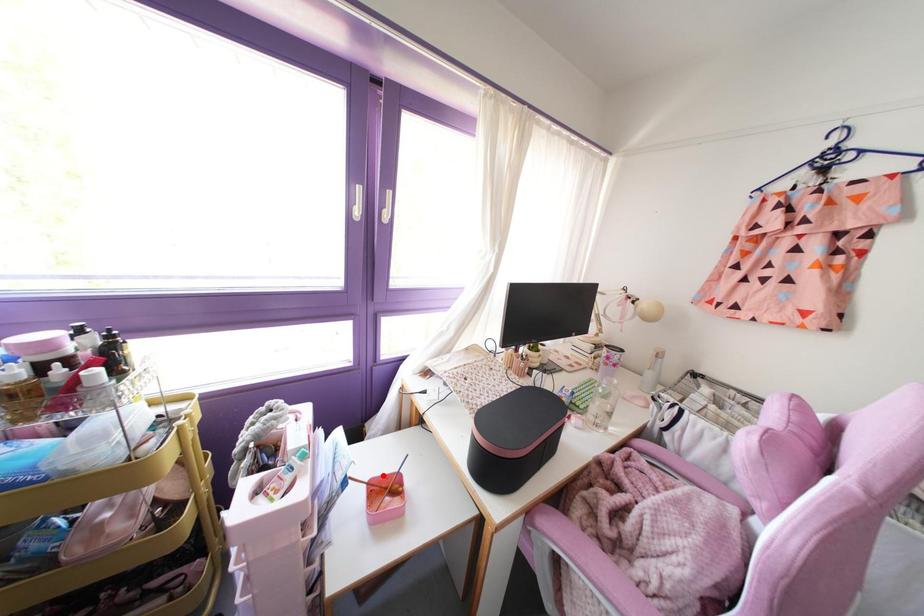
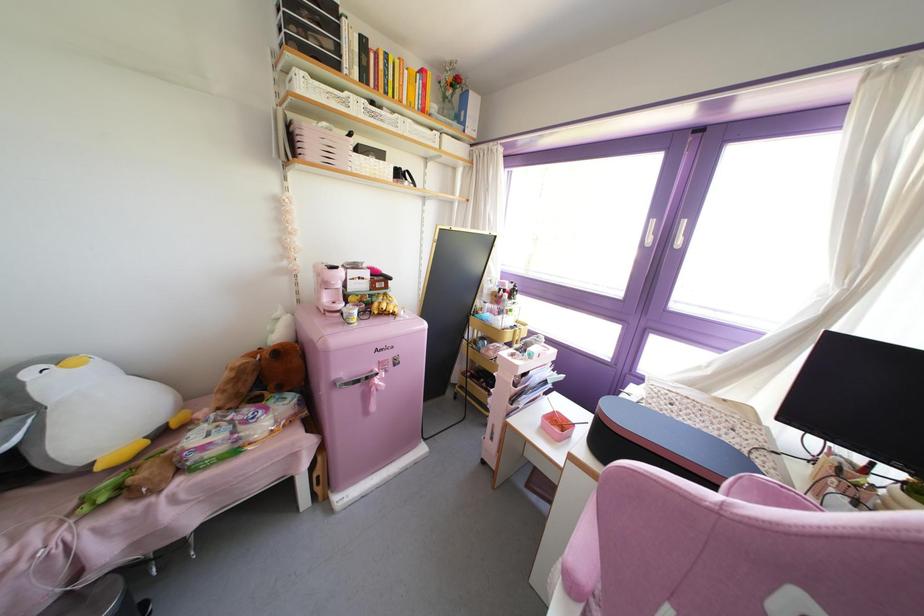
Question: I am providing you with two images of the same scene from different viewpoints. A red point is marked on the first image. Can you still see the location of the red point in image 2?

Choices:
 (A) Yes
 (B) No

Answer: (A)